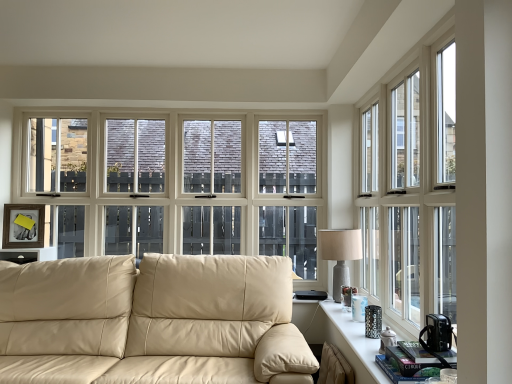
Find the location of a particular element. gray concrete table lamp at right is located at coordinates (x=340, y=254).

What do you see at coordinates (340, 254) in the screenshot?
I see `gray concrete table lamp at right` at bounding box center [340, 254].

The width and height of the screenshot is (512, 384). What do you see at coordinates (353, 343) in the screenshot?
I see `matte black table at right` at bounding box center [353, 343].

Describe the element at coordinates (24, 225) in the screenshot. The image size is (512, 384). I see `matte black picture frame at left` at that location.

In order to face matte black side table at left, should I rotate leftwards or rightwards?

To align with it, rotate left about 28.450°.

Consider the image. Measure the distance between matte black side table at left and camera.

The depth of matte black side table at left is 3.05 meters.

In order to face clear glass window at right, should I rotate leftwards or rightwards?

Turn right approximately 17.892 degrees to face it.

What do you see at coordinates (157, 317) in the screenshot?
I see `beige leather couch at center` at bounding box center [157, 317].

Where is `gray concrete table lamp at right`? The height and width of the screenshot is (384, 512). gray concrete table lamp at right is located at coordinates (340, 254).

Would you say clear glass window at right is outside matte black table at right?

clear glass window at right is positioned outside matte black table at right.

Is clear glass window at right shorter than matte black table at right?

No.

From the picture: Is the position of clear glass window at right more distant than that of matte black table at right?

No, clear glass window at right is in front of matte black table at right.

What's the angular difference between clear glass window at right and matte black table at right's facing directions?

0.439 degrees separate the facing orientations of clear glass window at right and matte black table at right.

Considering the positions of objects matte black picture frame at left and matte black side table at left in the image provided, who is more to the right, matte black picture frame at left or matte black side table at left?

From the viewer's perspective, matte black side table at left appears more on the right side.

Image resolution: width=512 pixels, height=384 pixels. I want to click on picture frame located on the left of matte black side table at left, so click(24, 225).

Can you confirm if matte black picture frame at left is taller than matte black side table at left?

Indeed, matte black picture frame at left has a greater height compared to matte black side table at left.

Which object is further away from the camera, beige leather couch at center or gray concrete table lamp at right?

gray concrete table lamp at right is further away from the camera.

Between beige leather couch at center and gray concrete table lamp at right, which one has larger width?

Wider between the two is beige leather couch at center.

From a real-world perspective, does beige leather couch at center stand above gray concrete table lamp at right?

No, from a real-world perspective, beige leather couch at center is not over gray concrete table lamp at right

Based on the photo, which is more to the right, matte black picture frame at left or beige leather couch at center?

beige leather couch at center.

Looking at the image, does matte black picture frame at left seem bigger or smaller compared to beige leather couch at center?

In the image, matte black picture frame at left appears to be smaller than beige leather couch at center.

Measure the distance from matte black picture frame at left to beige leather couch at center.

4.01 feet.

Between matte black picture frame at left and beige leather couch at center, which one has smaller width?

Thinner between the two is matte black picture frame at left.

Is beige leather couch at center facing towards matte black table at right?

No, beige leather couch at center does not turn towards matte black table at right.

Is beige leather couch at center in contact with matte black table at right?

They are not placed beside each other.

From the image's perspective, is beige leather couch at center located beneath matte black table at right?

Indeed, from the image's perspective, beige leather couch at center is shown beneath matte black table at right.

Is the position of gray concrete table lamp at right less distant than that of matte black picture frame at left?

Yes, the depth of gray concrete table lamp at right is less than that of matte black picture frame at left.

Is the surface of gray concrete table lamp at right in direct contact with matte black picture frame at left?

No, gray concrete table lamp at right is not in contact with matte black picture frame at left.

Does gray concrete table lamp at right have a greater width compared to matte black picture frame at left?

Correct, the width of gray concrete table lamp at right exceeds that of matte black picture frame at left.

What's the angular difference between gray concrete table lamp at right and matte black picture frame at left's facing directions?

There is a 23.1-degree angle between the facing directions of gray concrete table lamp at right and matte black picture frame at left.

Between matte black table at right and matte black picture frame at left, which one is positioned behind?

matte black picture frame at left is further away from the camera.

From the image's perspective, is matte black table at right on matte black picture frame at left?

No, from the image's perspective, matte black table at right is not over matte black picture frame at left.

Is matte black table at right at the left side of matte black picture frame at left?

In fact, matte black table at right is to the right of matte black picture frame at left.

How distant is matte black table at right from matte black picture frame at left?

matte black table at right is 2.31 meters from matte black picture frame at left.

Image resolution: width=512 pixels, height=384 pixels. I want to click on table below the clear glass window at right (from the image's perspective), so click(353, 343).

Identify the location of picture frame to the left of matte black side table at left. (24, 225).

When comparing their distances from matte black picture frame at left, does matte black table at right or clear glass window at right seem further?

clear glass window at right.

Looking at the image, which one is located further to matte black picture frame at left, beige leather couch at center or matte black side table at left?

beige leather couch at center lies further to matte black picture frame at left than the other object.

Looking at the image, which one is located closer to clear glass window at right, matte black table at right or gray concrete table lamp at right?

The object closer to clear glass window at right is gray concrete table lamp at right.

In the scene shown: Which object lies further to the anchor point gray concrete table lamp at right, beige leather couch at center or clear glass window at right?

beige leather couch at center lies further to gray concrete table lamp at right than the other object.

Estimate the real-world distances between objects in this image. Which object is further from clear glass window at right, gray concrete table lamp at right or beige leather couch at center?

Based on the image, beige leather couch at center appears to be further to clear glass window at right.

Looking at this image, from the image, which object appears to be farther from matte black picture frame at left, clear glass window at right or matte black table at right?

The object further to matte black picture frame at left is clear glass window at right.

Which object lies further to the anchor point matte black side table at left, clear glass window at right or gray concrete table lamp at right?

The object further to matte black side table at left is clear glass window at right.

Considering their positions, is clear glass window at right positioned further to beige leather couch at center than matte black table at right?

Based on the image, clear glass window at right appears to be further to beige leather couch at center.

At what (x,y) coordinates should I click in order to perform the action: click on table lamp between matte black side table at left and matte black table at right in the horizontal direction. Please return your answer as a coordinate pair (x, y). The width and height of the screenshot is (512, 384). Looking at the image, I should click on (340, 254).

This screenshot has width=512, height=384. In order to click on studio couch between matte black side table at left and matte black table at right in this screenshot , I will do `click(157, 317)`.

Image resolution: width=512 pixels, height=384 pixels. I want to click on studio couch between matte black side table at left and gray concrete table lamp at right, so click(x=157, y=317).

Locate an element on the screen. The width and height of the screenshot is (512, 384). table between beige leather couch at center and clear glass window at right from left to right is located at coordinates point(353,343).